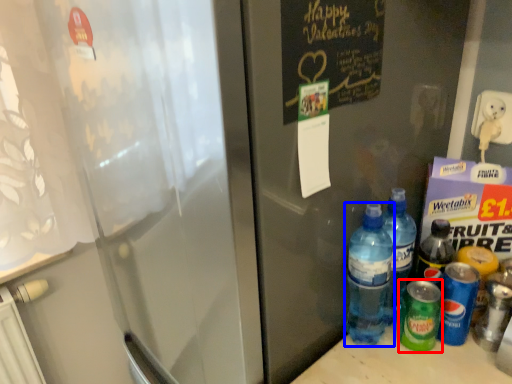
Question: Which of the following is the closest to the observer, bottle (highlighted by a red box) or bottle (highlighted by a blue box)?

Choices:
 (A) bottle
 (B) bottle

Answer: (B)